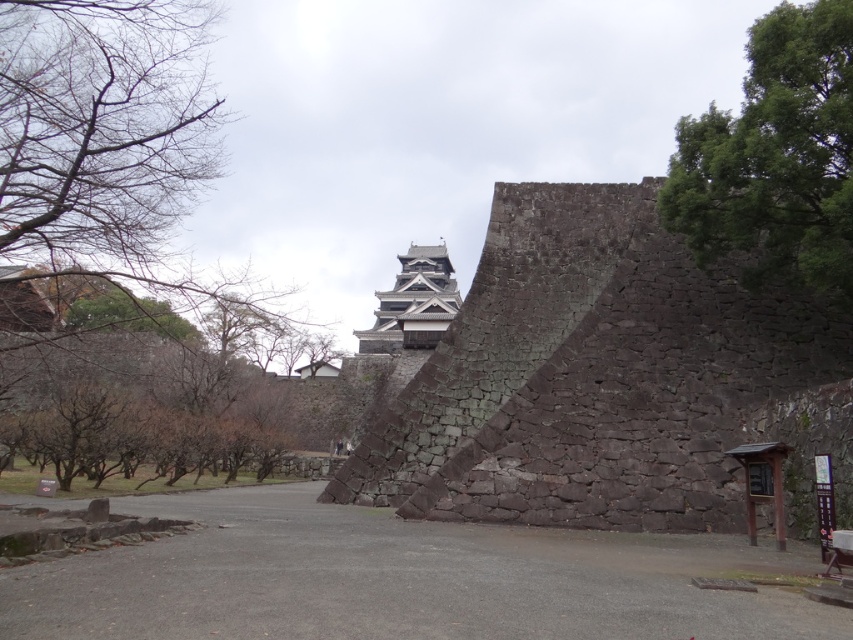
You are an architect examining the historical stone wall structure. You notice a green leafy tree at upper right and a dark gray stone tower at center. From your vantage point, which object is positioned higher in the image?

The green leafy tree at upper right is located above the dark gray stone tower at center, so it is positioned higher in the image.

In the scene shown: You are standing in front of a historical stone wall structure and want to take a photo of the brown leafless tree at left. If your camera has a maximum focus range of 50 meters, will you be able to capture the tree clearly?

The brown leafless tree at left is 50.64 meters away from the viewer, which exceeds the camera maximum focus range of 50 meters. Therefore, the camera cannot focus on the tree and capture it clearly.

You are an archaeologist examining the stone wall structure. You notice two points marked on the wall at coordinates point (190, 468) and point (755, 180). Which point is closer to you when standing in front of the wall?

Point (190, 468) is closer to you because it is further to the viewer than point (755, 180).